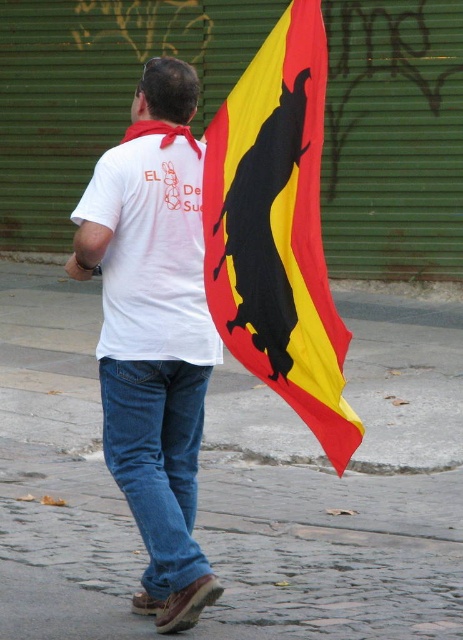
You are a fashion designer observing a person in the image. The person is wearing a white cotton shirt at center and denim jeans at lower center. Which clothing item is more to the left?

The white cotton shirt at center is positioned on the left side of denim jeans at lower center, so the white cotton shirt at center is more to the left.

You are a photographer trying to capture the white cotton shirt at center and denim jeans at lower center in a single frame. Which object should you focus on first to ensure both are in focus?

You should focus on the white cotton shirt at center first because it is closer to the viewer than the denim jeans at lower center. By focusing on the closer object, the jeans will fall within the depth of field and remain in focus.